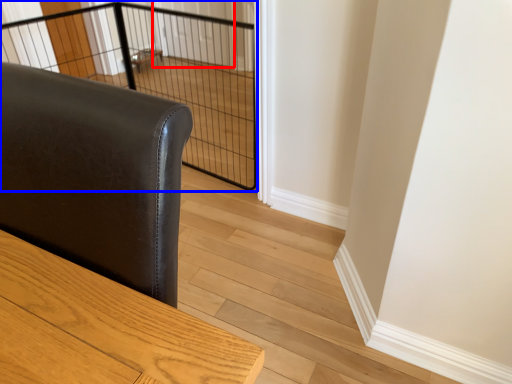
Question: Among these objects, which one is nearest to the camera, screen door (highlighted by a red box) or cage (highlighted by a blue box)?

Choices:
 (A) screen door
 (B) cage

Answer: (B)